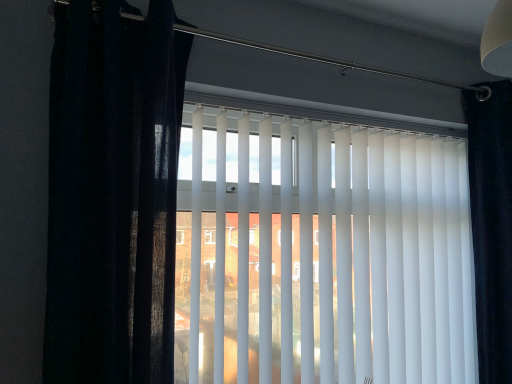
Question: Visually, is matte black curtain at left, acting as the second curtain starting from the back, positioned to the left or to the right of white matte vertical blinds at center?

Choices:
 (A) left
 (B) right

Answer: (A)

Question: From their relative heights in the image, would you say matte black curtain at left, marked as the first curtain in a left-to-right arrangement, is taller or shorter than white matte vertical blinds at center?

Choices:
 (A) tall
 (B) short

Answer: (B)

Question: Based on their relative distances, which object is farther from the matte black curtain at left, which is the 1th curtain in front-to-back order?

Choices:
 (A) black velvet curtain at right, acting as the second curtain starting from the left
 (B) white matte vertical blinds at center

Answer: (A)

Question: Which object is the farthest from the matte black curtain at left, acting as the second curtain starting from the back?

Choices:
 (A) white matte vertical blinds at center
 (B) black velvet curtain at right, the second curtain in the front-to-back sequence

Answer: (B)